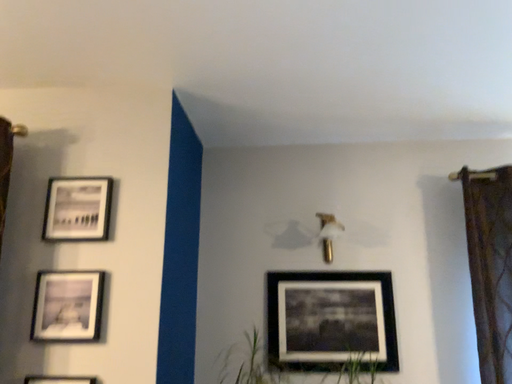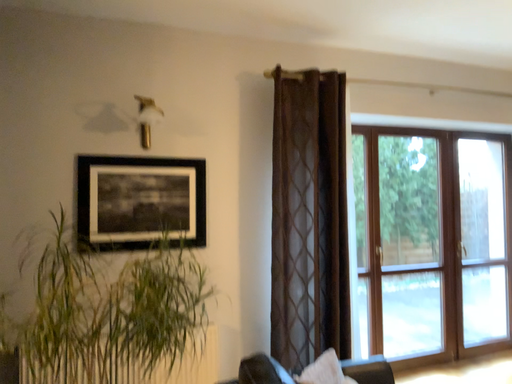
Question: Which way did the camera rotate in the video?

Choices:
 (A) rotated right
 (B) rotated left

Answer: (A)